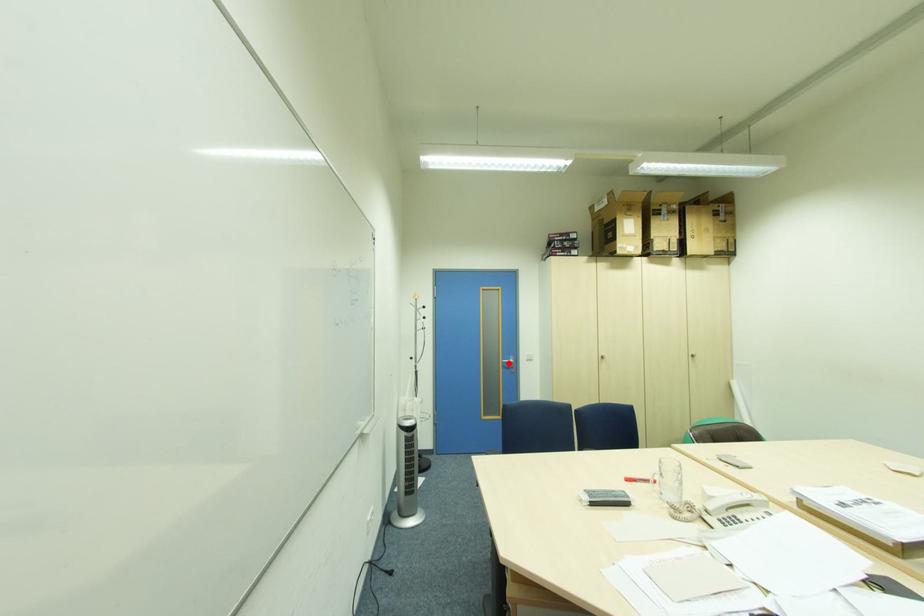
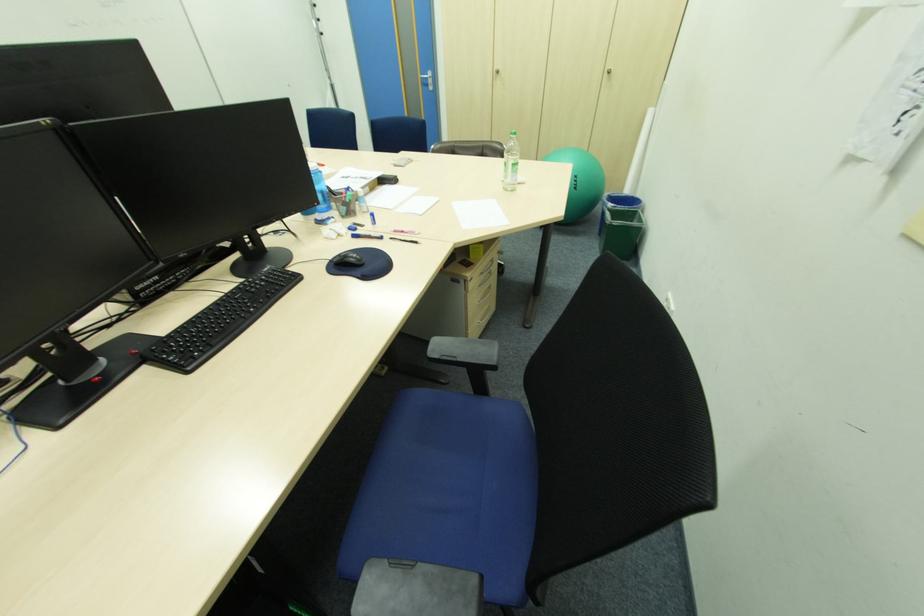
Question: I am providing you with two images of the same scene from different viewpoints. A red point is shown in image1. For the corresponding object point in image2, is it positioned nearer or farther from the camera?

Choices:
 (A) Nearer
 (B) Farther

Answer: (A)